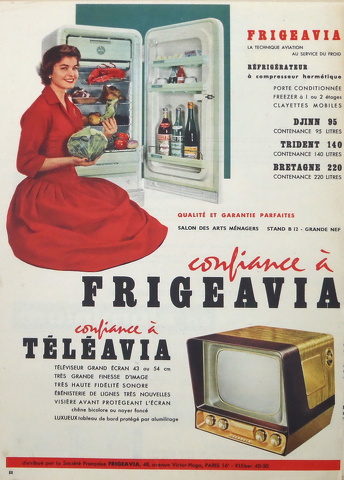
Image resolution: width=344 pixels, height=480 pixels. What are the coordinates of `green painted wall` in the screenshot? It's located at (145, 10).